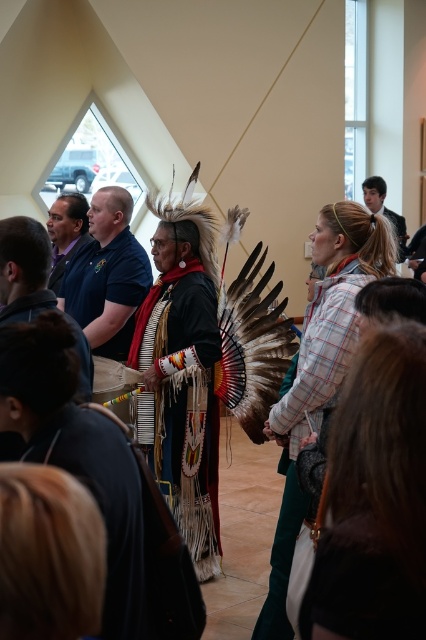
Does plush brown feather headdress at center have a greater width compared to plush brown fur vest at center?

Incorrect, plush brown feather headdress at center's width does not surpass plush brown fur vest at center's.

Which is below, plush brown feather headdress at center or plush brown fur vest at center?

plush brown feather headdress at center

Between point (290, 484) and point (382, 208), which one is positioned in front?

Point (290, 484)

The image size is (426, 640). Identify the location of plush brown feather headdress at center. (282, 554).

Can you confirm if matte black shirt at left is positioned to the left of plush brown fur vest at center?

Indeed, matte black shirt at left is positioned on the left side of plush brown fur vest at center.

Who is taller, matte black shirt at left or plush brown fur vest at center?

With more height is matte black shirt at left.

Between point (55, 289) and point (396, 228), which one is positioned behind?

The point (396, 228) is behind.

Identify the location of matte black shirt at left. (66, 232).

Is dark blue shirt at center smaller than matte black shirt at upper right?

Actually, dark blue shirt at center might be larger than matte black shirt at upper right.

Is dark blue shirt at center bigger than matte black shirt at upper right?

Yes, dark blue shirt at center is bigger than matte black shirt at upper right.

At what (x,y) coordinates should I click in order to perform the action: click on dark blue shirt at center. Please return your answer as a coordinate pair (x, y). The height and width of the screenshot is (640, 426). Looking at the image, I should click on (106, 275).

Where is `dark blue shirt at center`? The width and height of the screenshot is (426, 640). dark blue shirt at center is located at coordinates (106, 275).